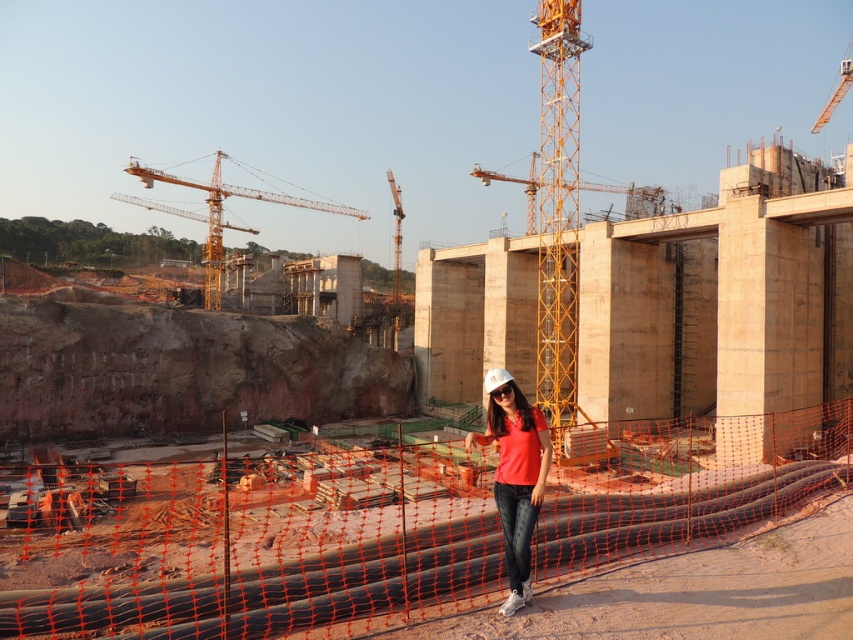
Question: Does matte red shirt at center have a lesser width compared to yellow metallic crane at upper left?

Choices:
 (A) no
 (B) yes

Answer: (B)

Question: Is orange mesh fence at center to the left of yellow metallic crane at upper left from the viewer's perspective?

Choices:
 (A) no
 (B) yes

Answer: (A)

Question: Which object appears closest to the camera in this image?

Choices:
 (A) orange mesh fence at center
 (B) yellow metallic crane at upper left

Answer: (A)

Question: Which point is closer to the camera?

Choices:
 (A) (524, 499)
 (B) (216, 236)
 (C) (641, 476)

Answer: (A)

Question: Is orange mesh fence at center smaller than yellow metallic crane at upper left?

Choices:
 (A) no
 (B) yes

Answer: (B)

Question: Among these objects, which one is farthest from the camera?

Choices:
 (A) yellow metallic crane at upper left
 (B) orange mesh fence at center

Answer: (A)